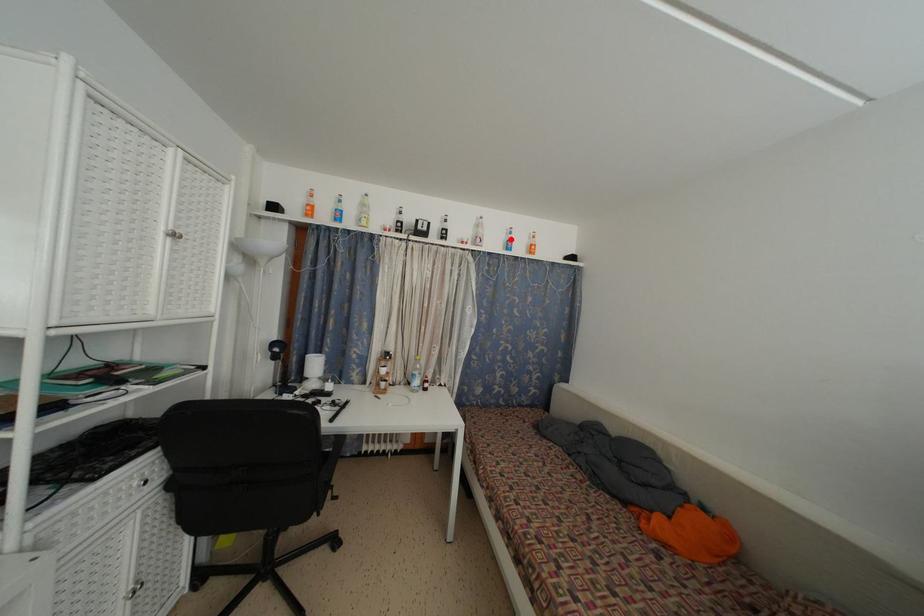
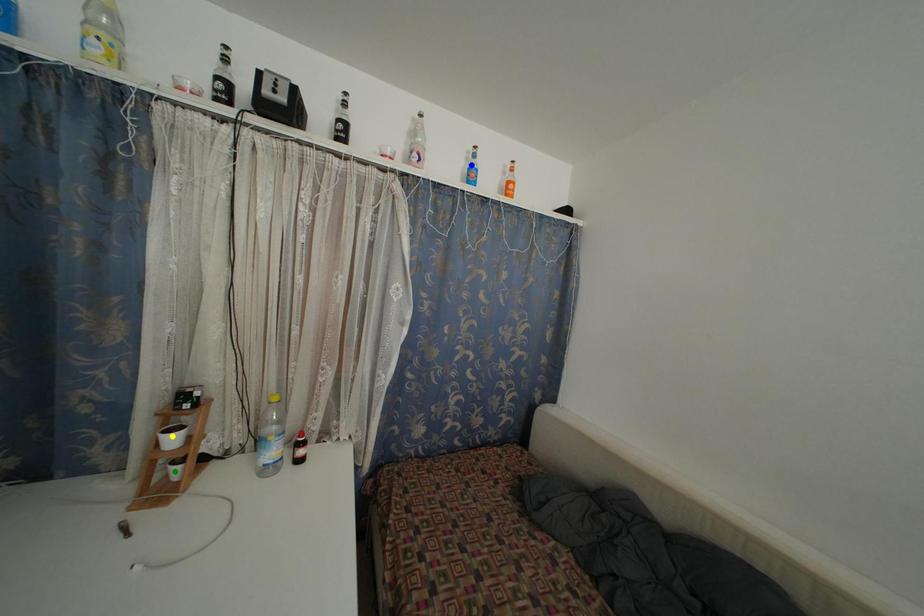
Question: I am providing you with two images of the same scene from different viewpoints. A red point is marked on the first image. You are given multiple points on the second image. Can you choose the point in image 2 that corresponds to the point in image 1?

Choices:
 (A) yellow point
 (B) blue point
 (C) green point

Answer: (B)